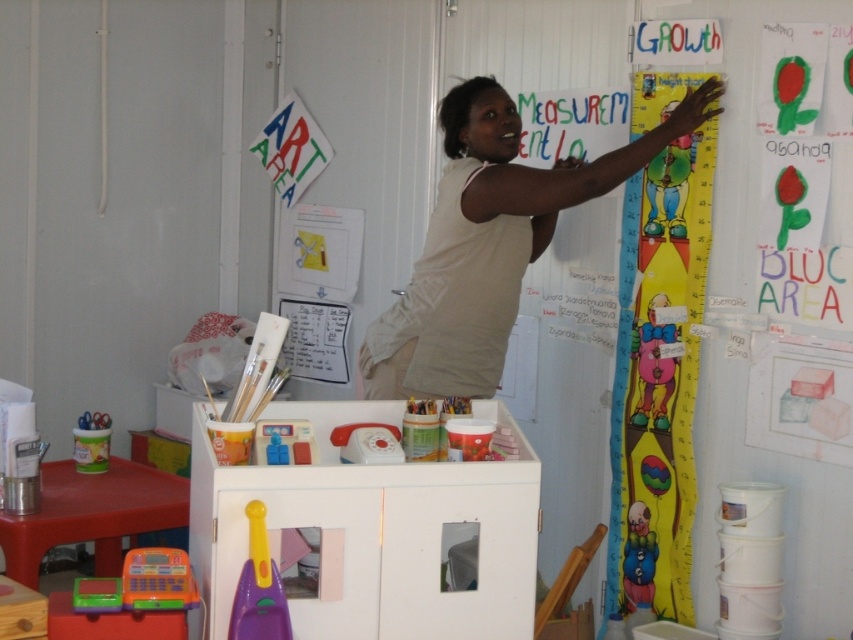
Question: Estimate the real-world distances between objects in this image. Which object is closer to the matte plastic clown at lower right?

Choices:
 (A) rubberized plastic cash register at lower left
 (B) beige fabric at upper center

Answer: (B)

Question: Which point is closer to the camera?

Choices:
 (A) (244, 609)
 (B) (376, 452)
 (C) (704, 260)

Answer: (A)

Question: Based on their relative distances, which object is nearer to the cartoon paper height chart at upper right?

Choices:
 (A) matte plastic clown at lower right
 (B) white plastic toy at center
 (C) rubberized plastic toy at lower left

Answer: (A)

Question: In this image, where is beige fabric at upper center located relative to white plastic toy at center?

Choices:
 (A) above
 (B) below

Answer: (A)

Question: Can you confirm if rubberized plastic cash register at lower left is positioned above white plastic toy at center?

Choices:
 (A) yes
 (B) no

Answer: (B)

Question: Observing the image, what is the correct spatial positioning of rubberized plastic toy at lower left in reference to white plastic toy at center?

Choices:
 (A) above
 (B) below

Answer: (B)